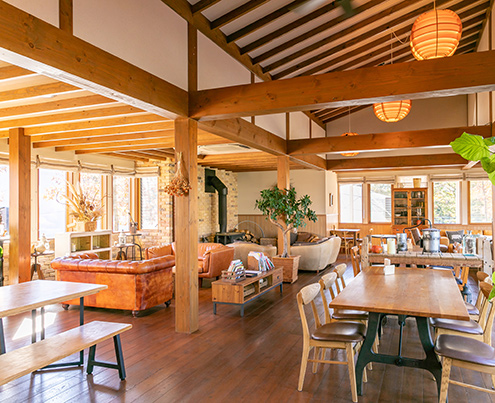
At what (x,y) coordinates should I click in order to perform the action: click on seats at the back table. Please return your answer as a coordinate pair (x, y). The width and height of the screenshot is (495, 403). Looking at the image, I should click on (355, 255), (360, 245).